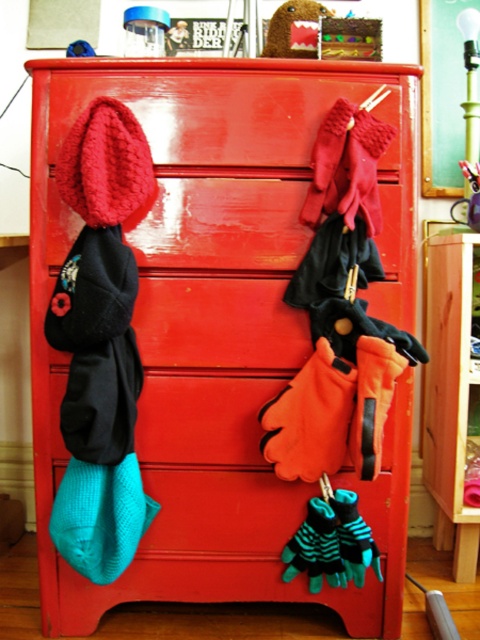
Can you confirm if teal knitted sock at lower left is positioned to the right of metallic silver scissors at upper right?

In fact, teal knitted sock at lower left is to the left of metallic silver scissors at upper right.

Which is below, teal knitted sock at lower left or metallic silver scissors at upper right?

Positioned lower is teal knitted sock at lower left.

What do you see at coordinates (100, 516) in the screenshot? The width and height of the screenshot is (480, 640). I see `teal knitted sock at lower left` at bounding box center [100, 516].

I want to click on teal knitted sock at lower left, so click(100, 516).

In the scene shown: Is fuzzy brown bear at upper center taller than metallic silver scissors at upper right?

Incorrect, fuzzy brown bear at upper center's height is not larger of metallic silver scissors at upper right's.

Does point (296, 45) come behind point (474, 198)?

No, it is in front of (474, 198).

Between point (315, 22) and point (477, 218), which one is positioned in front?

Positioned in front is point (315, 22).

At what (x,y) coordinates should I click in order to perform the action: click on fuzzy brown bear at upper center. Please return your answer as a coordinate pair (x, y). Image resolution: width=480 pixels, height=640 pixels. Looking at the image, I should click on 295,29.

Does teal knitted sock at lower left have a larger size compared to fuzzy brown bear at upper center?

Correct, teal knitted sock at lower left is larger in size than fuzzy brown bear at upper center.

Which is behind, point (66, 497) or point (320, 10)?

The point (320, 10) is behind.

What do you see at coordinates (100, 516) in the screenshot? The width and height of the screenshot is (480, 640). I see `teal knitted sock at lower left` at bounding box center [100, 516].

The width and height of the screenshot is (480, 640). I want to click on teal knitted sock at lower left, so click(100, 516).